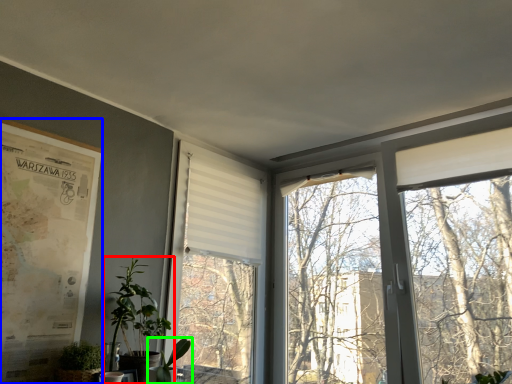
Question: Which is nearer to the houseplant (highlighted by a red box)? poster page (highlighted by a blue box) or houseplant (highlighted by a green box).

Choices:
 (A) poster page
 (B) houseplant

Answer: (B)